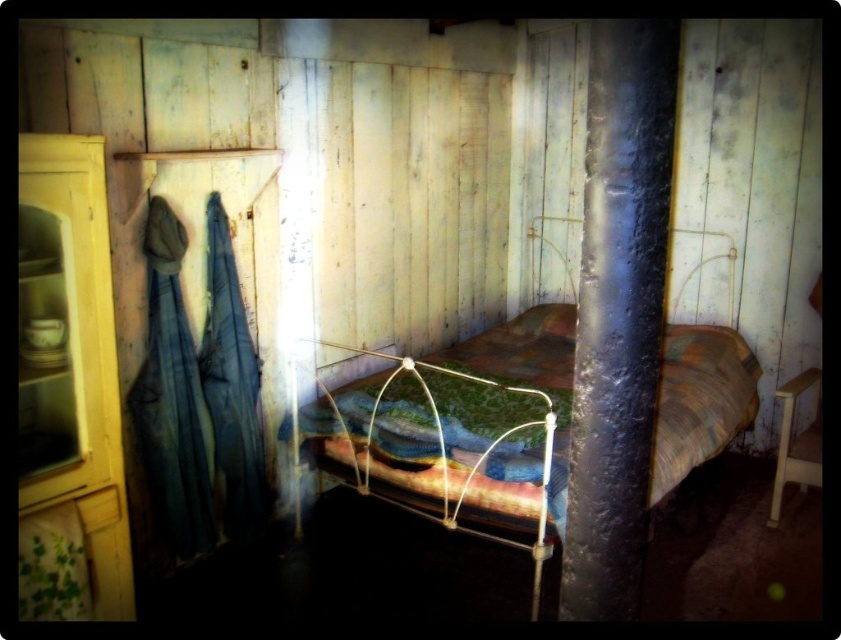
Question: Among these objects, which one is farthest from the camera?

Choices:
 (A) black rubberized pole at center
 (B) yellow wood cabinet at left
 (C) rustic wood bed at center

Answer: (C)

Question: Estimate the real-world distances between objects in this image. Which object is closer to the rustic wood bed at center?

Choices:
 (A) black rubberized pole at center
 (B) yellow wood cabinet at left

Answer: (B)

Question: In this image, where is black rubberized pole at center located relative to yellow wood cabinet at left?

Choices:
 (A) left
 (B) right

Answer: (B)

Question: Which point appears closest to the camera in this image?

Choices:
 (A) (69, 512)
 (B) (600, 154)
 (C) (294, 426)

Answer: (B)

Question: Is black rubberized pole at center wider than yellow wood cabinet at left?

Choices:
 (A) no
 (B) yes

Answer: (A)

Question: Does rustic wood bed at center appear on the right side of yellow wood cabinet at left?

Choices:
 (A) no
 (B) yes

Answer: (B)